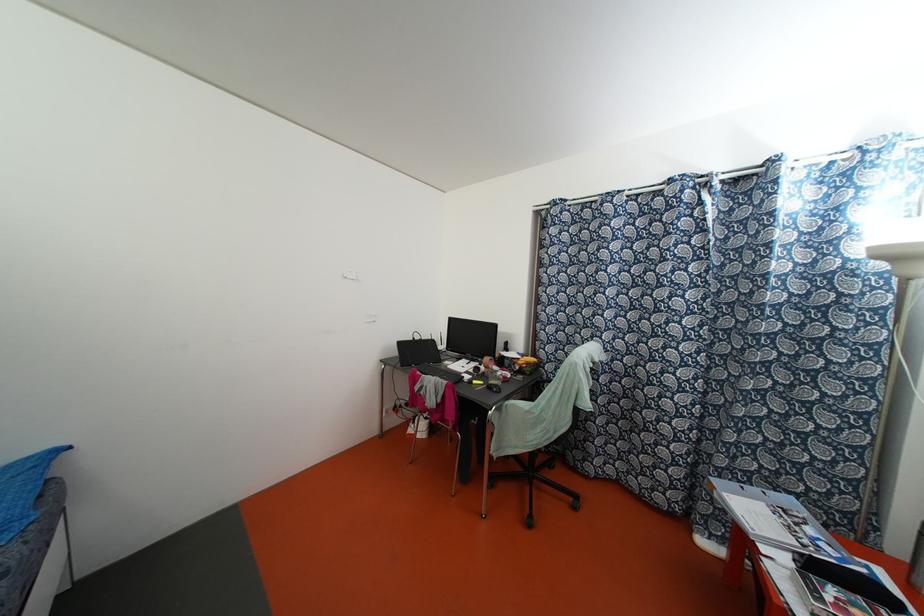
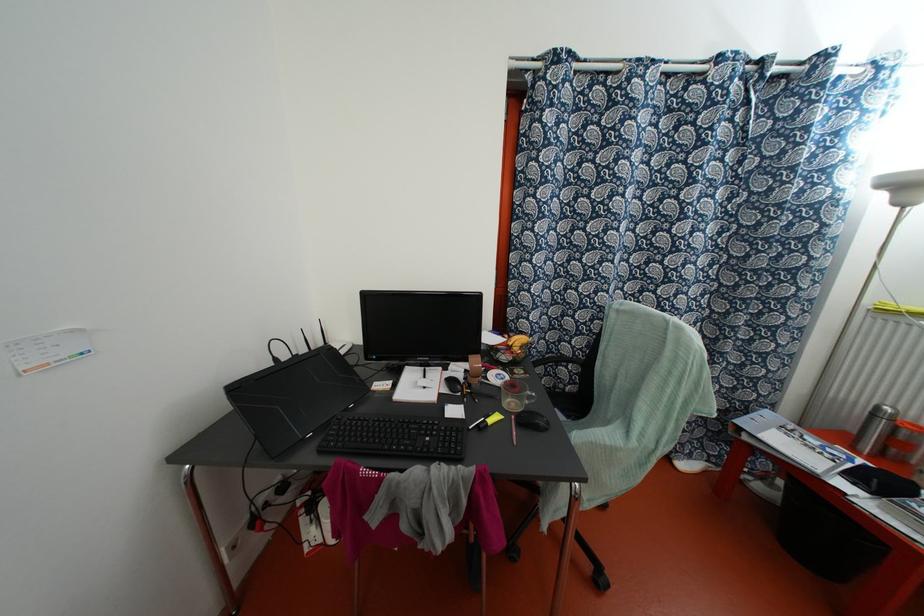
Where in the second image is the point corresponding to pixel 473 381 from the first image?

(489, 421)